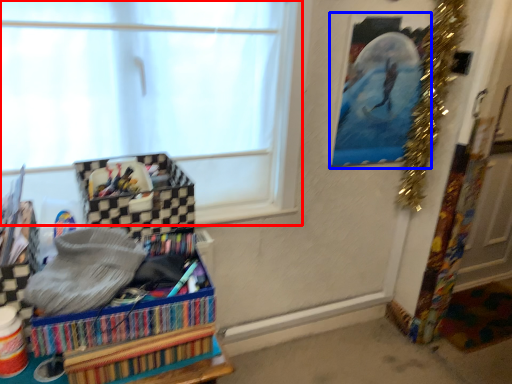
Question: Which of the following is the closest to the observer, window (highlighted by a red box) or picture frame (highlighted by a blue box)?

Choices:
 (A) window
 (B) picture frame

Answer: (A)